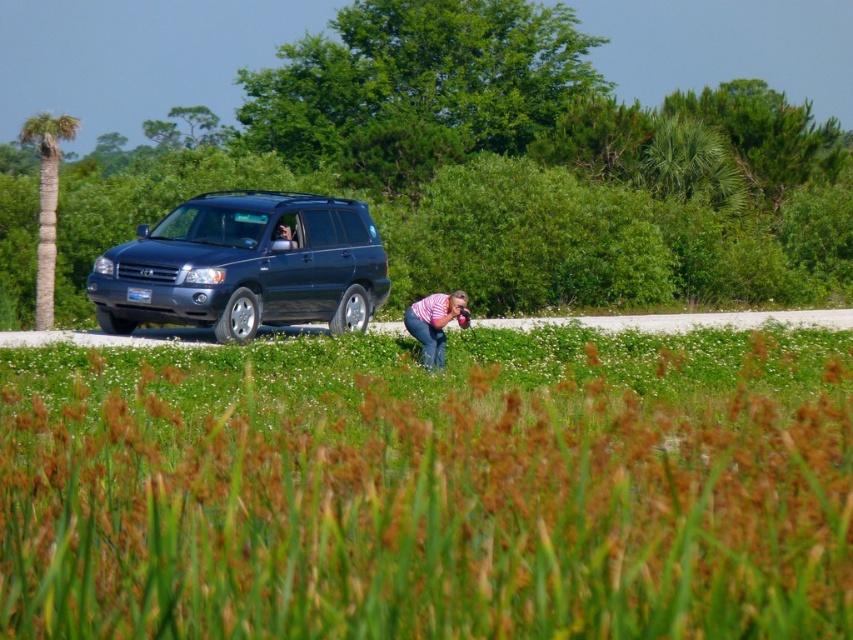
Is green grass at center positioned behind pink striped shirt at center?

No.

Does green grass at center lie in front of pink striped shirt at center?

Yes.

Locate an element on the screen. This screenshot has width=853, height=640. green grass at center is located at coordinates (427, 499).

Find the location of a particular element. shiny dark blue suv at center is located at coordinates (245, 266).

Which of these two, shiny dark blue suv at center or pink striped shirt at center, stands taller?

With more height is shiny dark blue suv at center.

The width and height of the screenshot is (853, 640). What do you see at coordinates (245, 266) in the screenshot? I see `shiny dark blue suv at center` at bounding box center [245, 266].

Where is `shiny dark blue suv at center`? The image size is (853, 640). shiny dark blue suv at center is located at coordinates (245, 266).

Who is more distant from viewer, (546,632) or (279,310)?

Positioned behind is point (279,310).

At what (x,y) coordinates should I click in order to perform the action: click on green grass at center. Please return your answer as a coordinate pair (x, y). This screenshot has width=853, height=640. Looking at the image, I should click on tap(427, 499).

The height and width of the screenshot is (640, 853). I want to click on green grass at center, so click(427, 499).